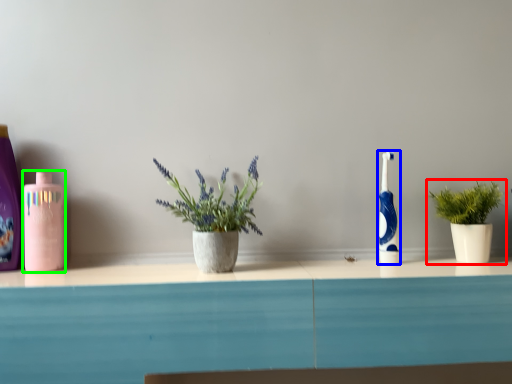
Question: Estimate the real-world distances between objects in this image. Which object is farther from houseplant (highlighted by a red box), toothbrush (highlighted by a blue box) or mouthwash (highlighted by a green box)?

Choices:
 (A) toothbrush
 (B) mouthwash

Answer: (B)